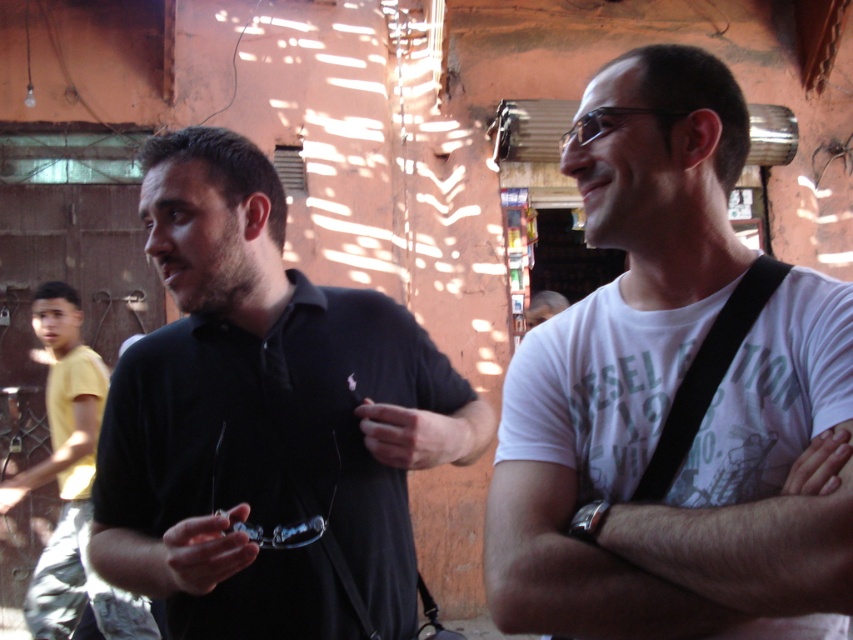
You are a photographer positioned behind the two people in the scene. You want to take a photo that includes both the black matte shirt at left and the yellow cotton shirt at left without any overlap. Given that your camera has a maximum focus range of 3 meters, will you be able to capture both subjects clearly in the frame?

The black matte shirt at left is 2.96 meters from the yellow cotton shirt at left. Since the distance between them is within the camera maximum focus range of 3 meters, you can capture both subjects clearly in the frame.